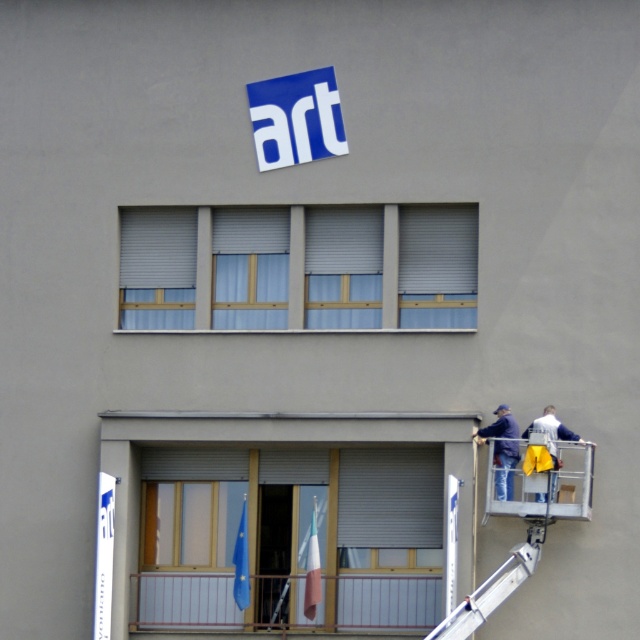
Who is higher up, blue fabric at upper center or light blue fabric at center?

Positioned higher is light blue fabric at center.

Does point (472, 285) come in front of point (282, 241)?

Yes, it is.

The height and width of the screenshot is (640, 640). What are the coordinates of `blue fabric at upper center` in the screenshot? It's located at (300, 268).

Does light blue fabric at center have a smaller size compared to yellow fabric at lower center?

Incorrect, light blue fabric at center is not smaller in size than yellow fabric at lower center.

Describe the element at coordinates (250, 268) in the screenshot. The width and height of the screenshot is (640, 640). I see `light blue fabric at center` at that location.

Locate an element on the screen. light blue fabric at center is located at coordinates (250, 268).

Who is positioned more to the right, white matte window at center or yellow fabric at lower right?

From the viewer's perspective, yellow fabric at lower right appears more on the right side.

Between point (416, 316) and point (554, 451), which one is positioned behind?

Point (416, 316)

At what (x,y) coordinates should I click in order to perform the action: click on white matte window at center. Please return your answer as a coordinate pair (x, y). This screenshot has width=640, height=640. Looking at the image, I should click on (436, 266).